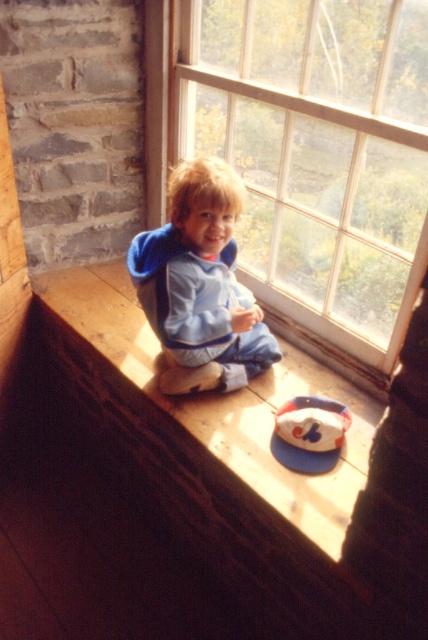
Question: Does transparent glass window at upper center have a lesser width compared to wooden at lower center?

Choices:
 (A) yes
 (B) no

Answer: (A)

Question: Which object is positioned farthest from the blue fleece jacket at center?

Choices:
 (A) wooden at lower center
 (B) transparent glass window at upper center

Answer: (B)

Question: Considering the relative positions of transparent glass window at upper center and wooden at lower center in the image provided, where is transparent glass window at upper center located with respect to wooden at lower center?

Choices:
 (A) below
 (B) above

Answer: (B)

Question: Is transparent glass window at upper center further to camera compared to blue fleece jacket at center?

Choices:
 (A) yes
 (B) no

Answer: (B)

Question: Among these points, which one is farthest from the camera?

Choices:
 (A) (240, 205)
 (B) (104, 344)

Answer: (B)

Question: Which of the following is the closest to the observer?

Choices:
 (A) (196, 344)
 (B) (89, 307)

Answer: (A)